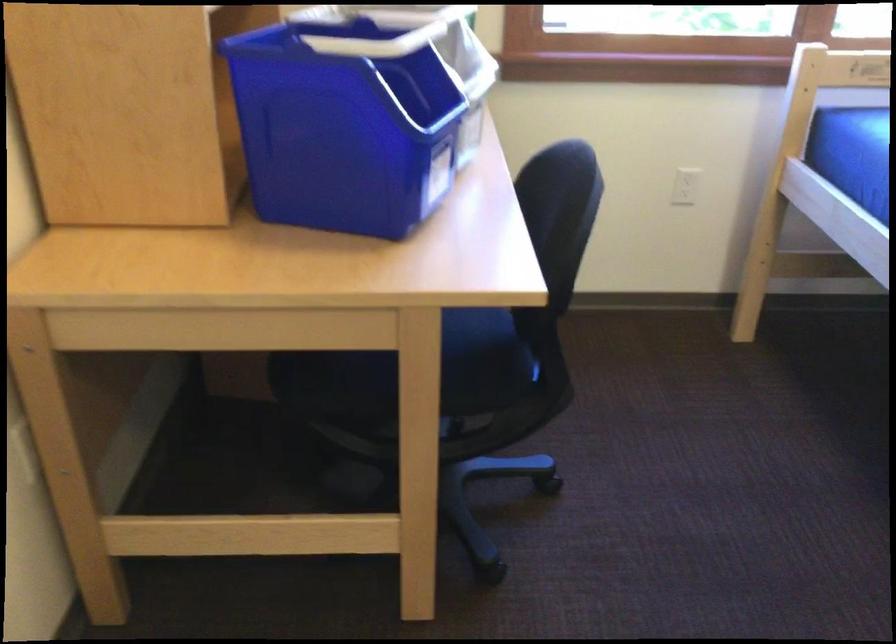
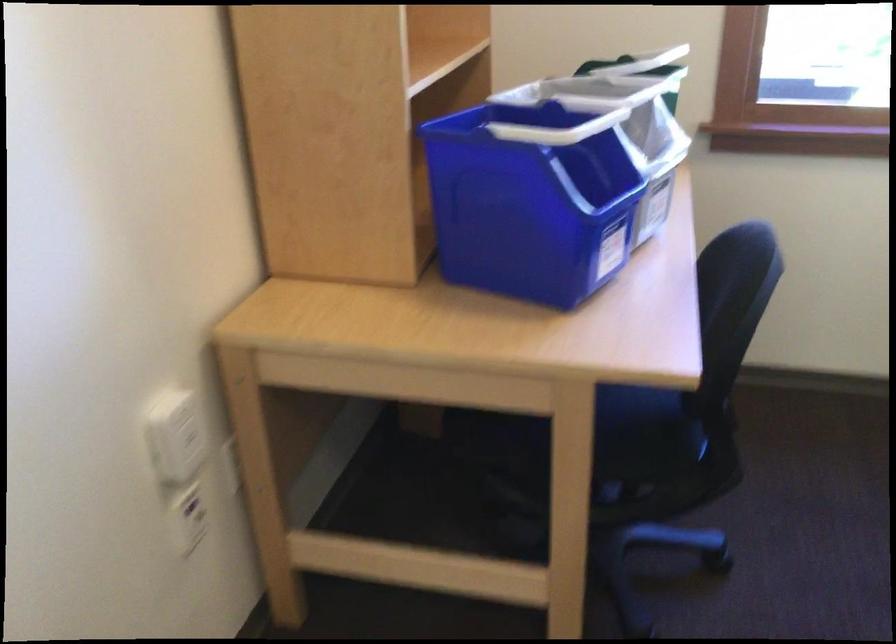
The point at (469, 401) is marked in the first image. Where is the corresponding point in the second image?

(625, 469)